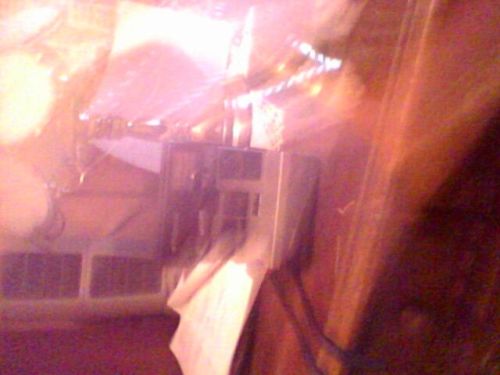
Locate an element on the screen. The height and width of the screenshot is (375, 500). window is located at coordinates (464, 276).